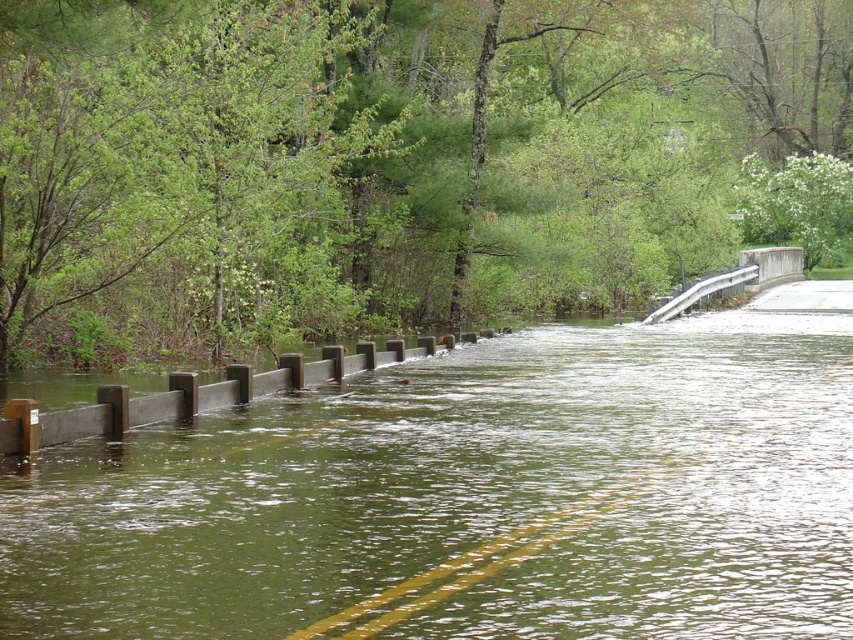
Question: Is brown wooden barrier at center wider than concrete/rough bridge at upper right?

Choices:
 (A) yes
 (B) no

Answer: (A)

Question: Which object is farther from the camera taking this photo?

Choices:
 (A) green leafy tree at upper center
 (B) white textured tree at upper center
 (C) brown wooden barrier at center
 (D) concrete/rough bridge at upper right

Answer: (B)

Question: Among these objects, which one is nearest to the camera?

Choices:
 (A) green leafy tree at upper center
 (B) concrete/rough bridge at upper right
 (C) white textured tree at upper center
 (D) brown wooden barrier at center

Answer: (D)

Question: Among these points, which one is farthest from the camera?

Choices:
 (A) (791, 266)
 (B) (450, 8)
 (C) (764, 586)
 (D) (781, 212)

Answer: (D)

Question: Can you confirm if white textured tree at upper center is positioned below concrete/rough bridge at upper right?

Choices:
 (A) no
 (B) yes

Answer: (A)

Question: Can you confirm if white textured tree at upper center is wider than concrete/rough bridge at upper right?

Choices:
 (A) yes
 (B) no

Answer: (B)